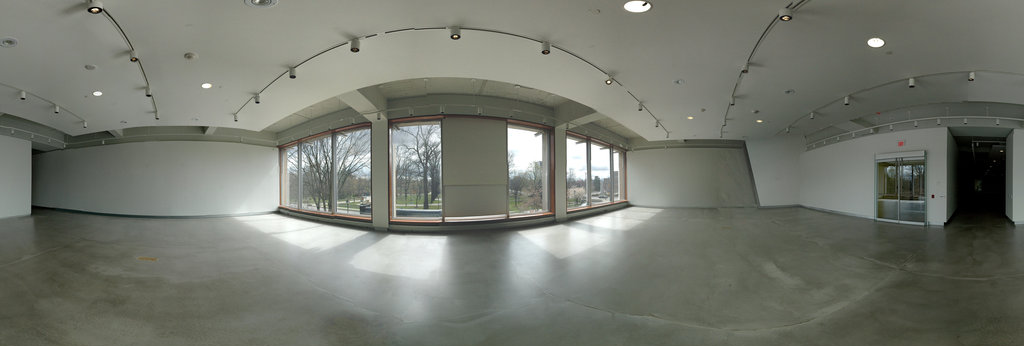
This screenshot has height=346, width=1024. I want to click on baseboard in hallway, so click(952, 216), click(1007, 220).